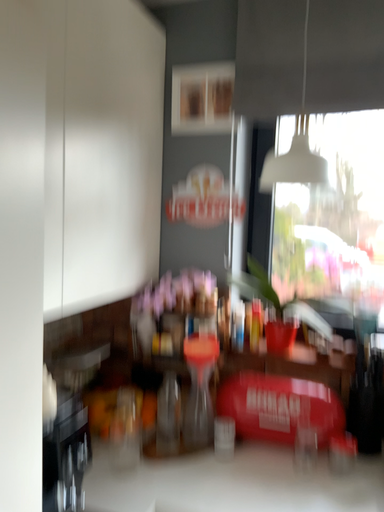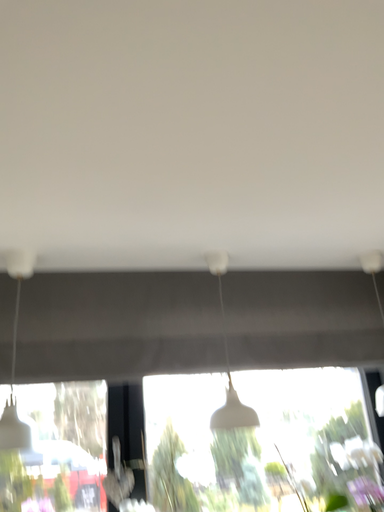
Question: Which way did the camera rotate in the video?

Choices:
 (A) rotated right
 (B) rotated left

Answer: (A)